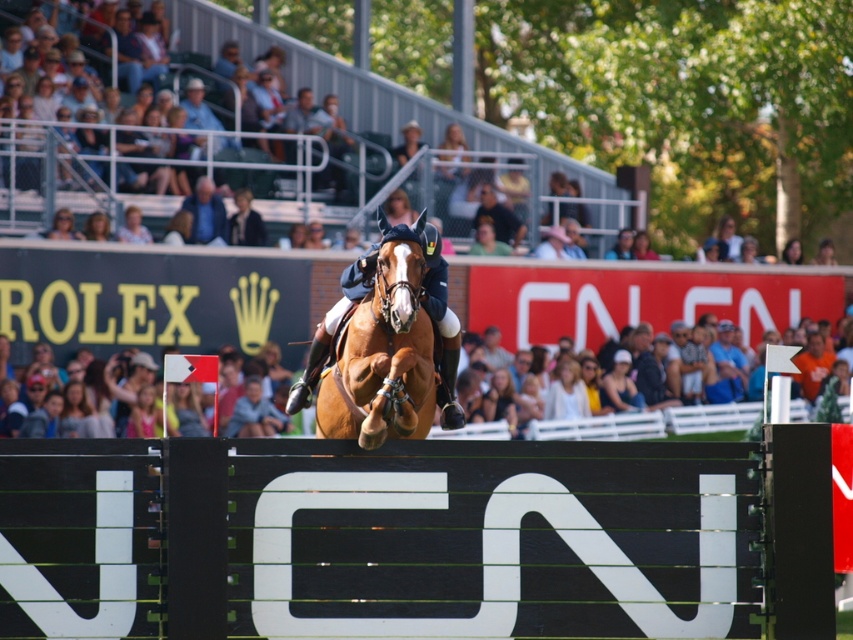
You are a photographer at the equestrian event. You want to capture a photo of the light brown hair at center and the black plastic hurdle at center in the same frame. Based on their positions, which object should be placed on the left side of the photo?

The black plastic hurdle at center should be placed on the left side of the photo because it is to the left of the light brown hair at center.

You are a photographer at the equestrian event. You want to capture a photo of the white cotton shirt at center and the black plastic hurdle at center such that both are clearly visible. Considering their heights, which object should you position closer to the camera to ensure both are fully visible in the frame?

The black plastic hurdle at center is taller than the white cotton shirt at center. To ensure both are fully visible, position the black plastic hurdle at center closer to the camera so its height doesn not block the view of the white cotton shirt at center.

You are a photographer at the equestrian event. You want to capture a photo of the glossy brown horse at center jumping over the black plastic hurdle at center. Based on their positions, which object should be positioned to the left in your camera frame?

The glossy brown horse at center should be positioned to the left of the black plastic hurdle at center in your camera frame because the black plastic hurdle at center is to the right of glossy brown horse at center.